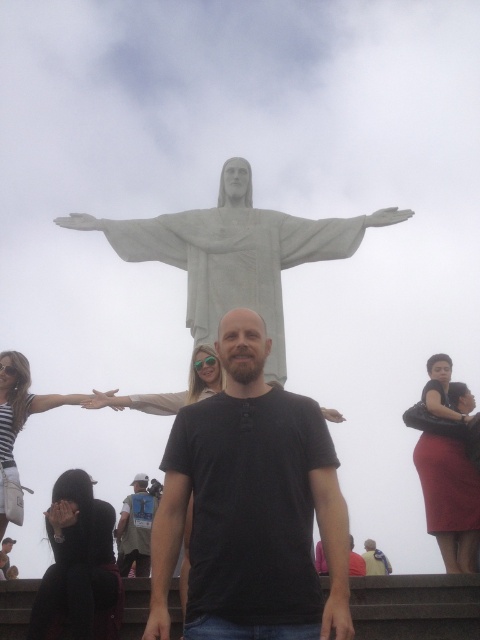
You are a fashion designer observing the scene at Christ the Redeemer. You notice the matte red skirt at lower right and the light brown leather jacket at center. Which item of clothing is higher in the image?

The matte red skirt at lower right is taller than the light brown leather jacket at center.

You are a photographer trying to capture a photo of the matte red skirt at lower right and the black matte arm at center. Which object should you focus on first if you want to ensure both are in sharp focus, considering their heights?

The matte red skirt at lower right is taller than the black matte arm at center, so you should focus on the matte red skirt at lower right first to ensure both are in sharp focus.

You are a photographer setting up a shot of the Christ the Redeemer statue. You notice a matte red skirt at lower right and a light brown leather jacket at center in the foreground. To ensure they don not block the statue, which item is more likely to be within the camera frame closer to the edge?

The matte red skirt at lower right is more likely to be closer to the edge of the camera frame because it is positioned at the lower right, which is typically near the frame edge, while the light brown leather jacket at center is centrally located.